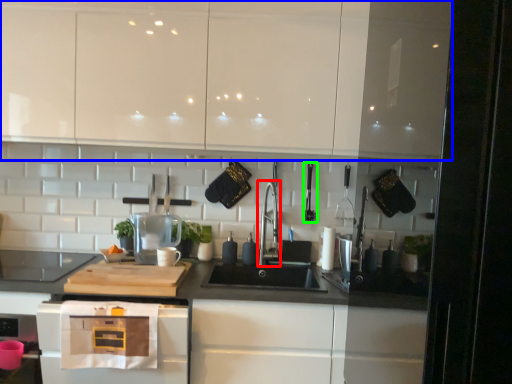
Question: Based on their relative distances, which object is farther from faucet (highlighted by a red box)? Choose from cabinetry (highlighted by a blue box) and appliance (highlighted by a green box).

Choices:
 (A) cabinetry
 (B) appliance

Answer: (A)